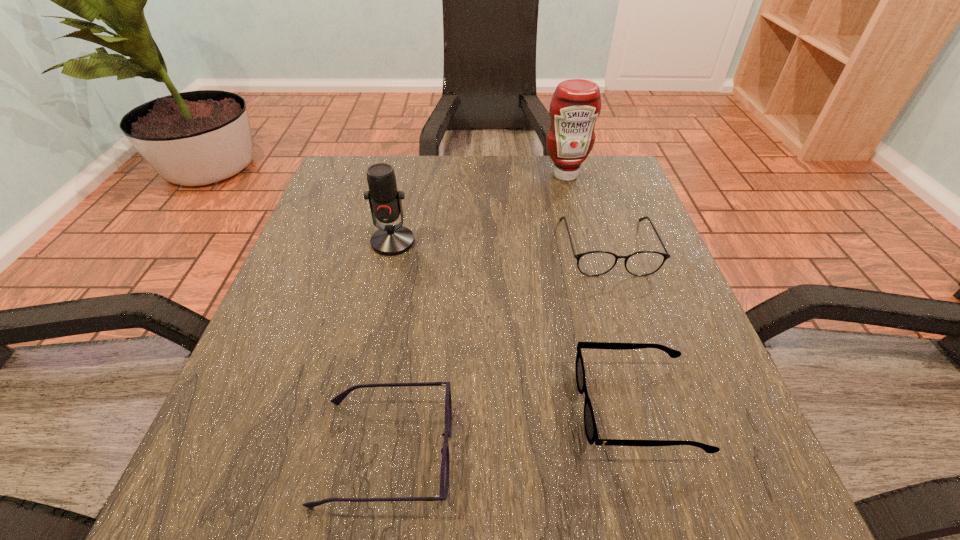
What are the coordinates of `vacant space that satisfies the following two spatial constraints: 1. on the front-facing side of the farthest spectacles; 2. on the front-facing side of the leftmost spectacles` in the screenshot? It's located at (673, 452).